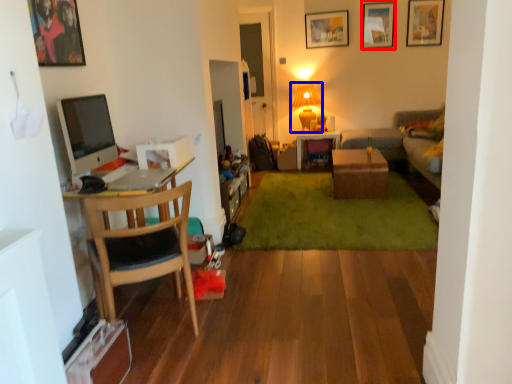
Question: Which object appears farthest to the camera in this image, picture frame (highlighted by a red box) or lamp (highlighted by a blue box)?

Choices:
 (A) picture frame
 (B) lamp

Answer: (B)